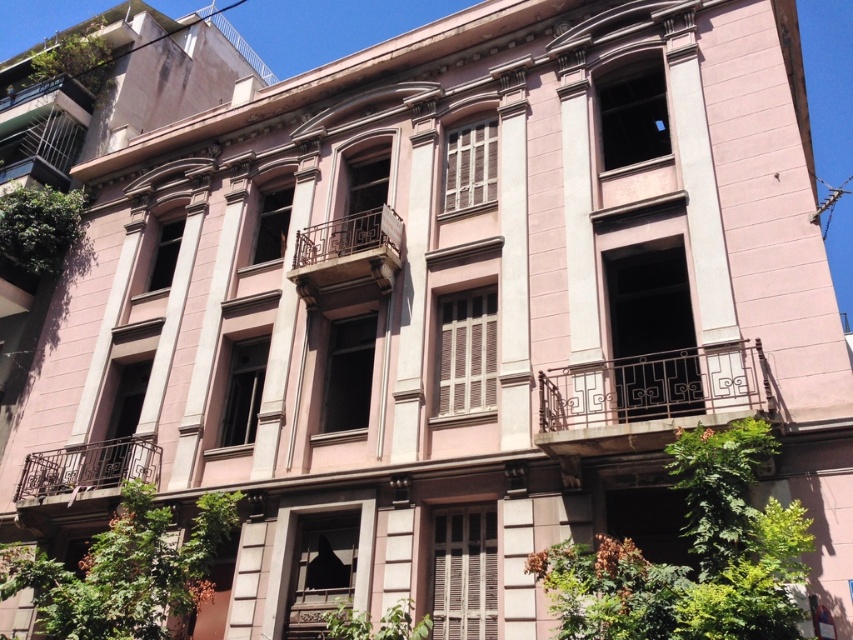
Question: Can you confirm if iron-patterned balcony at center-right is smaller than rustic metal balcony at center?

Choices:
 (A) yes
 (B) no

Answer: (A)

Question: Which object is closer to the camera taking this photo?

Choices:
 (A) iron-patterned balcony at center-right
 (B) rustic metal balcony at center

Answer: (A)

Question: Which of the following is the farthest from the observer?

Choices:
 (A) (717, 412)
 (B) (144, 464)
 (C) (335, 220)

Answer: (C)

Question: Which point is closer to the camera?

Choices:
 (A) iron-patterned balcony at center-right
 (B) rustic metal balcony at center

Answer: (A)

Question: Does iron-patterned balcony at center-right appear on the right side of brown wrought iron balcony at lower left?

Choices:
 (A) no
 (B) yes

Answer: (B)

Question: In this image, where is iron-patterned balcony at center-right located relative to brown wrought iron balcony at lower left?

Choices:
 (A) right
 (B) left

Answer: (A)